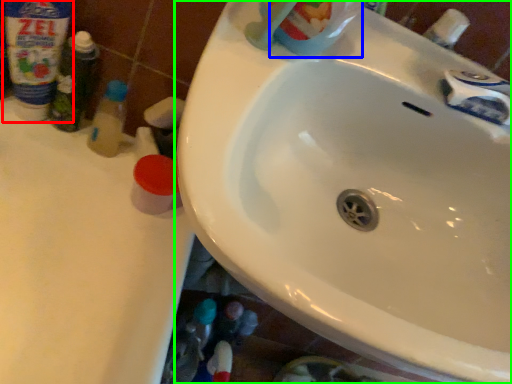
Question: Which object is the closest to the cleaning product (highlighted by a red box)? Choose among these: cleaning product (highlighted by a blue box) or sink (highlighted by a green box).

Choices:
 (A) cleaning product
 (B) sink

Answer: (A)